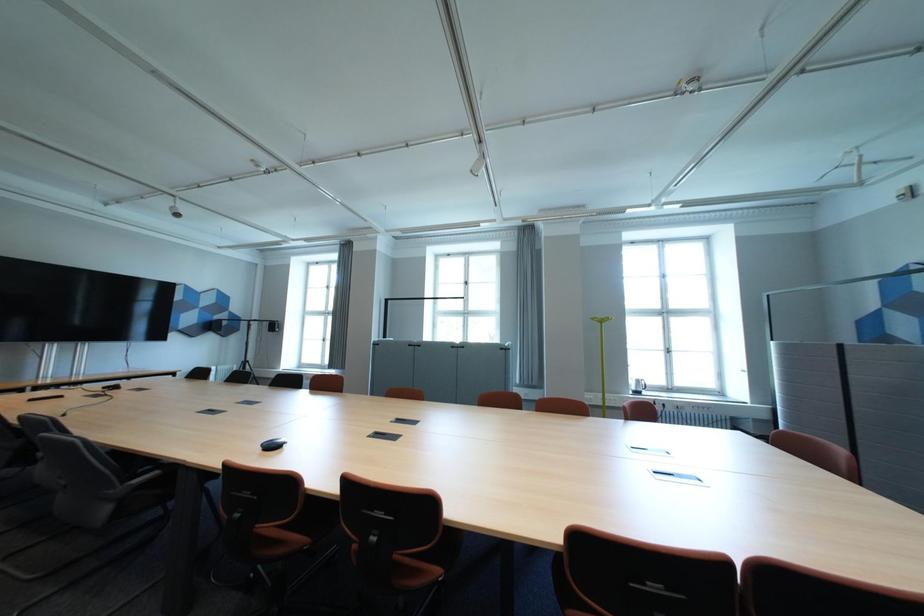
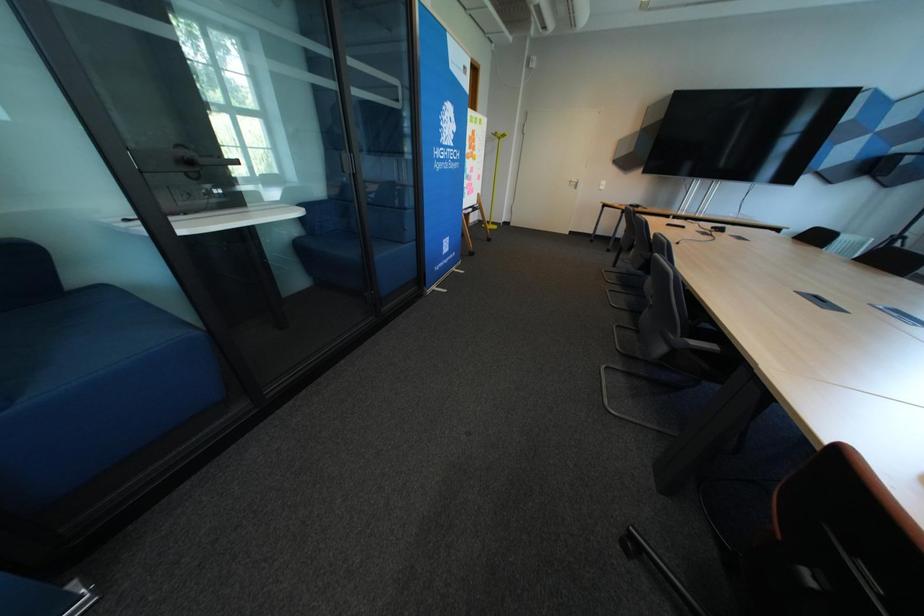
First-person continuous shooting, in which direction is the camera rotating?

The rotation direction of the camera is left-down.